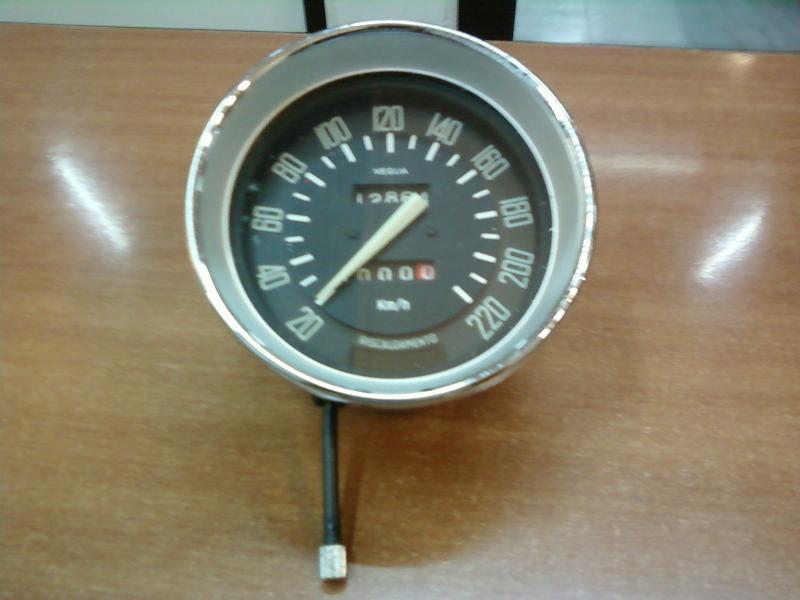
Where is `table`? Image resolution: width=800 pixels, height=600 pixels. table is located at coordinates (658, 254).